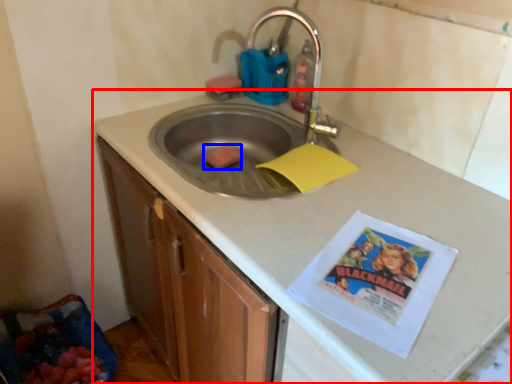
Question: Which object is closer to the camera taking this photo, countertop (highlighted by a red box) or food (highlighted by a blue box)?

Choices:
 (A) countertop
 (B) food

Answer: (A)